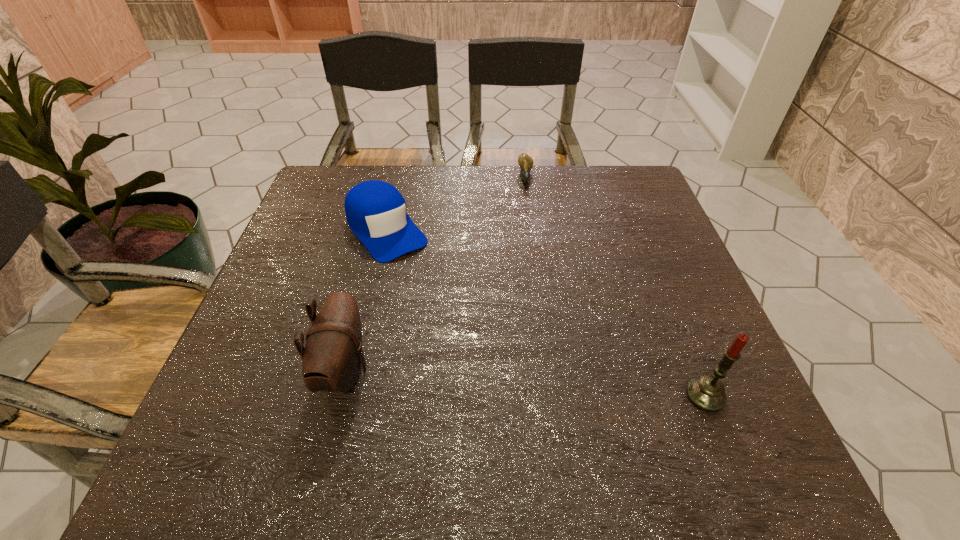
Image resolution: width=960 pixels, height=540 pixels. I want to click on object located at the far left corner, so click(375, 210).

Identify the location of object situated at the near right corner. (707, 393).

This screenshot has width=960, height=540. I want to click on vacant space at the far edge of the desktop, so click(559, 180).

This screenshot has width=960, height=540. I want to click on free space at the left edge of the desktop, so click(346, 229).

Locate an element on the screen. The width and height of the screenshot is (960, 540). free region at the right edge of the desktop is located at coordinates (694, 327).

The height and width of the screenshot is (540, 960). What are the coordinates of `vacant point at the near left corner` in the screenshot? It's located at (229, 381).

I want to click on vacant space at the far right corner of the desktop, so click(x=586, y=166).

Identify the location of free spot between the third object from left to right and the pouch. (435, 274).

This screenshot has height=540, width=960. Identify the location of empty space between the rightmost object and the pouch. (525, 383).

The image size is (960, 540). In order to click on empty location between the pouch and the rightmost object in this screenshot , I will do `click(525, 383)`.